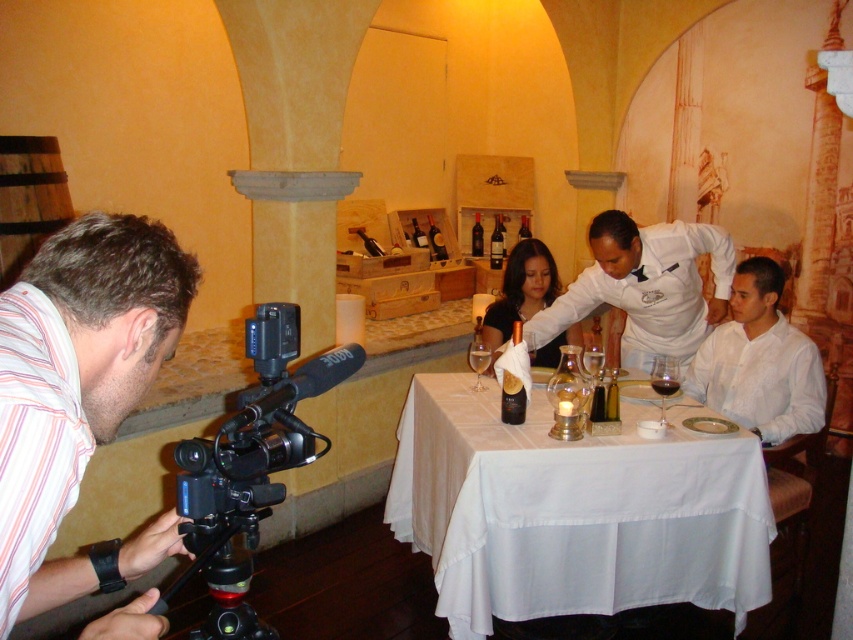
You are a photographer positioned at the camera. You need to adjust your lens to focus on the matte black dress at center. Based on its position, is the dress closer to the left or right side of the table?

The matte black dress at center is located at point 0.453 on the x and y axis, so it is centered on the table.

You are setting up a camera in the wine tasting room. The white cloth table at center and the white uniform at center are both in your view. Which object is taller?

The white cloth table at center is taller than the white uniform at center.

You are a photographer standing behind the camera. You need to ensure that both the matte black dress at center and the clear glass wine glass at center are in focus. Given that your camera can only focus on objects within a 10 inch range, will both items be in focus?

The distance between the matte black dress at center and the clear glass wine glass at center is 12.08 inches. Since this exceeds the 10 inch focus range, both items cannot be in focus simultaneously.